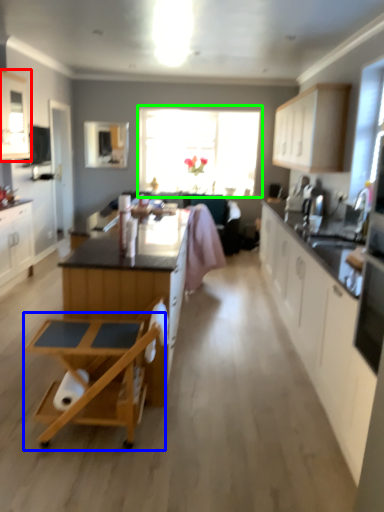
Question: Which object is positioned farthest from cabinetry (highlighted by a red box)? Select from table (highlighted by a blue box) and window (highlighted by a green box).

Choices:
 (A) table
 (B) window

Answer: (A)